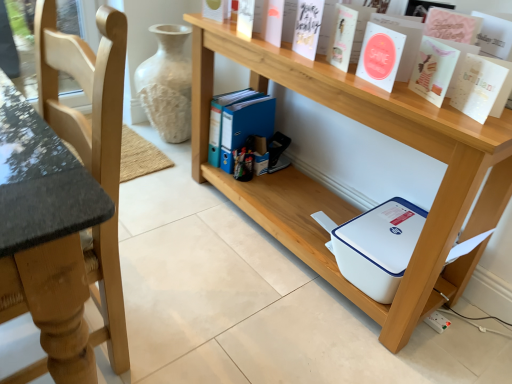
Image resolution: width=512 pixels, height=384 pixels. Find the location of `vacant space positioned to the left of matte pink card at upper right, arranged as the 2th paperback book when viewed from the right`. vacant space positioned to the left of matte pink card at upper right, arranged as the 2th paperback book when viewed from the right is located at coordinates (390, 93).